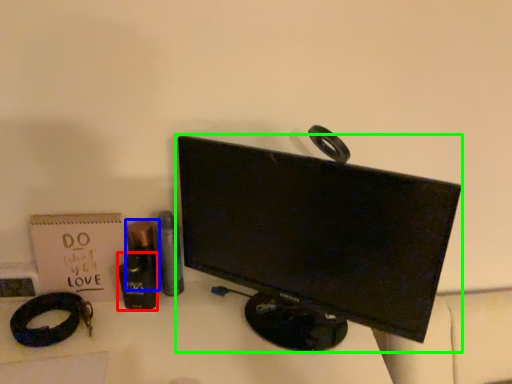
Question: Which object is positioned farthest from toiletry (highlighted by a red box)? Select from toiletry (highlighted by a blue box) and computer monitor (highlighted by a green box).

Choices:
 (A) toiletry
 (B) computer monitor

Answer: (B)